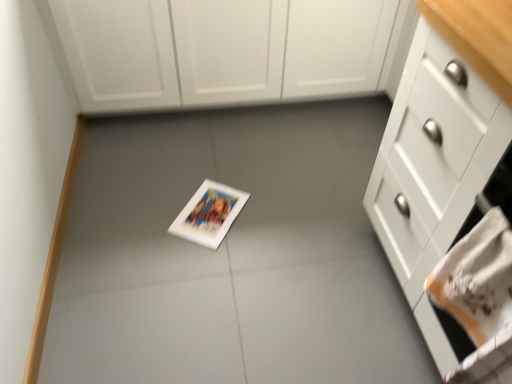
Question: In which direction should I rotate to look at white matte cabinet at upper center, marked as the second cabinetry in a bottom-to-top arrangement?

Choices:
 (A) left
 (B) right

Answer: (B)

Question: Can you confirm if white matte cabinet at upper center, marked as the second cabinetry in a bottom-to-top arrangement, is positioned to the left of white glossy cabinet at right, the second cabinetry in the top-to-bottom sequence?

Choices:
 (A) no
 (B) yes

Answer: (B)

Question: From the image's perspective, would you say white matte cabinet at upper center, the first cabinetry from the back, is shown under white glossy cabinet at right, which appears as the 1th cabinetry when ordered from the bottom?

Choices:
 (A) yes
 (B) no

Answer: (B)

Question: From a real-world perspective, is white matte cabinet at upper center, acting as the first cabinetry starting from the top, positioned under white glossy cabinet at right, the second cabinetry in the top-to-bottom sequence, based on gravity?

Choices:
 (A) yes
 (B) no

Answer: (A)

Question: Is white matte cabinet at upper center, the first cabinetry from the back, wider than white glossy cabinet at right, the second cabinetry in the top-to-bottom sequence?

Choices:
 (A) yes
 (B) no

Answer: (A)

Question: Is white matte cabinet at upper center, acting as the first cabinetry starting from the top, thinner than white glossy cabinet at right, which appears as the 1th cabinetry when ordered from the bottom?

Choices:
 (A) yes
 (B) no

Answer: (B)

Question: Could you tell me if white matte cabinet at upper center, acting as the first cabinetry starting from the top, is turned towards white glossy cabinet at right, which appears as the 1th cabinetry when ordered from the bottom?

Choices:
 (A) no
 (B) yes

Answer: (B)

Question: Does white glossy cabinet at right, the 2th cabinetry in the back-to-front sequence, have a lesser width compared to white matte cabinet at upper center, acting as the first cabinetry starting from the top?

Choices:
 (A) no
 (B) yes

Answer: (B)

Question: Can you confirm if white glossy cabinet at right, positioned as the first cabinetry in front-to-back order, is shorter than white matte cabinet at upper center, marked as the second cabinetry in a bottom-to-top arrangement?

Choices:
 (A) yes
 (B) no

Answer: (B)

Question: Does white glossy cabinet at right, positioned as the first cabinetry in front-to-back order, have a greater width compared to white matte cabinet at upper center, acting as the first cabinetry starting from the top?

Choices:
 (A) no
 (B) yes

Answer: (A)

Question: Would you say white matte cabinet at upper center, placed as the second cabinetry when sorted from front to back, is part of white glossy cabinet at right, the second cabinetry in the top-to-bottom sequence,'s contents?

Choices:
 (A) no
 (B) yes

Answer: (A)

Question: From a real-world perspective, is white glossy cabinet at right, positioned as the first cabinetry in front-to-back order, beneath white matte cabinet at upper center, placed as the second cabinetry when sorted from front to back?

Choices:
 (A) no
 (B) yes

Answer: (A)

Question: From the image's perspective, would you say white glossy cabinet at right, positioned as the first cabinetry in front-to-back order, is shown under white matte cabinet at upper center, marked as the second cabinetry in a bottom-to-top arrangement?

Choices:
 (A) no
 (B) yes

Answer: (B)

Question: Is the surface of white embroidered hand towel at lower right in direct contact with white matte cabinet at upper center, placed as the second cabinetry when sorted from front to back?

Choices:
 (A) no
 (B) yes

Answer: (A)